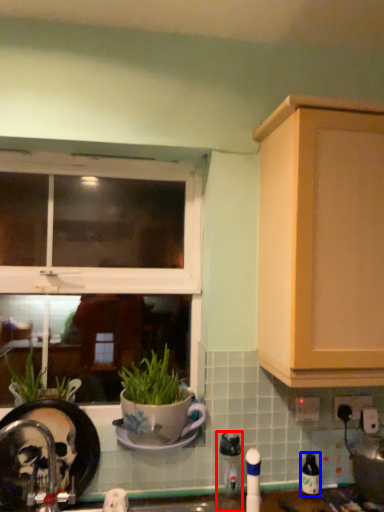
Question: Which of the following is the closest to the observer, appliance (highlighted by a red box) or bottle (highlighted by a blue box)?

Choices:
 (A) appliance
 (B) bottle

Answer: (A)